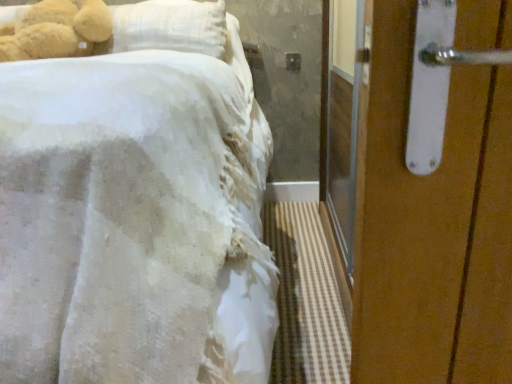
Question: Can you confirm if white fabric bed at left is taller than white matte door handle at upper right?

Choices:
 (A) yes
 (B) no

Answer: (A)

Question: Is white fabric bed at left beside white matte door handle at upper right?

Choices:
 (A) yes
 (B) no

Answer: (B)

Question: Can you confirm if white fabric bed at left is bigger than white matte door handle at upper right?

Choices:
 (A) yes
 (B) no

Answer: (A)

Question: From the image's perspective, would you say white fabric bed at left is positioned over white matte door handle at upper right?

Choices:
 (A) yes
 (B) no

Answer: (B)

Question: Is white fabric bed at left closer to the viewer compared to white matte door handle at upper right?

Choices:
 (A) no
 (B) yes

Answer: (B)

Question: From the image's perspective, is white fabric bed at left positioned above or below white matte door handle at upper right?

Choices:
 (A) below
 (B) above

Answer: (A)

Question: In the image, is white fabric bed at left positioned in front of or behind white matte door handle at upper right?

Choices:
 (A) front
 (B) behind

Answer: (A)

Question: Would you say white fabric bed at left is to the left or to the right of white matte door handle at upper right in the picture?

Choices:
 (A) right
 (B) left

Answer: (B)

Question: Does point (96, 288) appear closer or farther from the camera than point (498, 140)?

Choices:
 (A) closer
 (B) farther

Answer: (B)

Question: Is point (142, 119) positioned closer to the camera than point (96, 1)?

Choices:
 (A) farther
 (B) closer

Answer: (B)

Question: Considering their positions, is white fabric bed at left located in front of or behind soft plush teddy bear at upper left?

Choices:
 (A) front
 (B) behind

Answer: (A)

Question: From their relative heights in the image, would you say white fabric bed at left is taller or shorter than soft plush teddy bear at upper left?

Choices:
 (A) short
 (B) tall

Answer: (B)

Question: In the image, is white fabric bed at left on the left side or the right side of soft plush teddy bear at upper left?

Choices:
 (A) left
 (B) right

Answer: (B)

Question: Is point (60, 4) closer or farther from the camera than point (485, 249)?

Choices:
 (A) closer
 (B) farther

Answer: (B)

Question: Looking at their shapes, would you say soft plush teddy bear at upper left is wider or thinner than white matte door handle at upper right?

Choices:
 (A) wide
 (B) thin

Answer: (B)